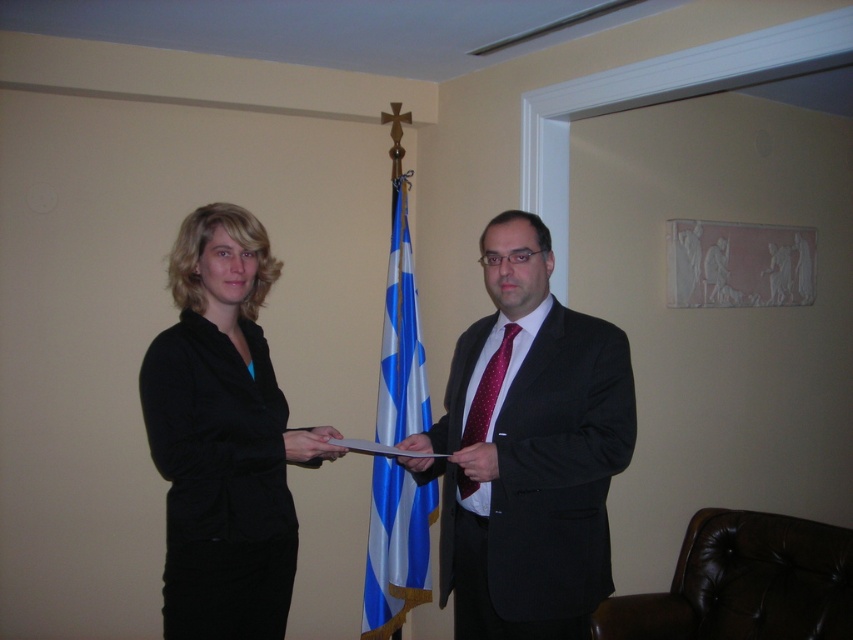
Does red dotted fabric tie at center appear on the left side of matte black hand at center?

In fact, red dotted fabric tie at center is to the right of matte black hand at center.

Does red dotted fabric tie at center have a smaller size compared to matte black hand at center?

Actually, red dotted fabric tie at center might be larger than matte black hand at center.

Find the location of `red dotted fabric tie at center`. red dotted fabric tie at center is located at coordinates (488, 388).

Measure the distance between blue/white fabric flag at center and matte black hand at center.

blue/white fabric flag at center and matte black hand at center are 35.74 inches apart.

The width and height of the screenshot is (853, 640). Identify the location of blue/white fabric flag at center. (396, 548).

Is black matte blazer at left bigger than matte black hand at center?

Yes.

Between black matte blazer at left and matte black hand at center, which one is positioned lower?

matte black hand at center is below.

This screenshot has width=853, height=640. What are the coordinates of `black matte blazer at left` in the screenshot? It's located at (219, 436).

Identify the location of black matte blazer at left. (219, 436).